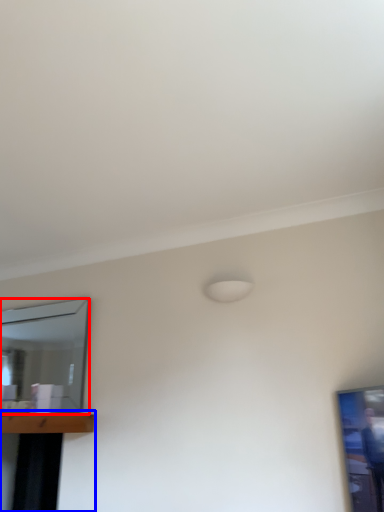
Question: Which object is further to the camera taking this photo, mirror (highlighted by a red box) or table (highlighted by a blue box)?

Choices:
 (A) mirror
 (B) table

Answer: (A)